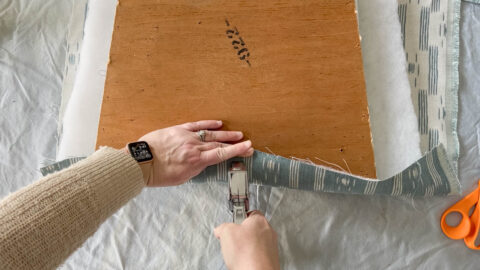
This screenshot has width=480, height=270. I want to click on grey/blue fabric with white stripes, so click(298, 178).